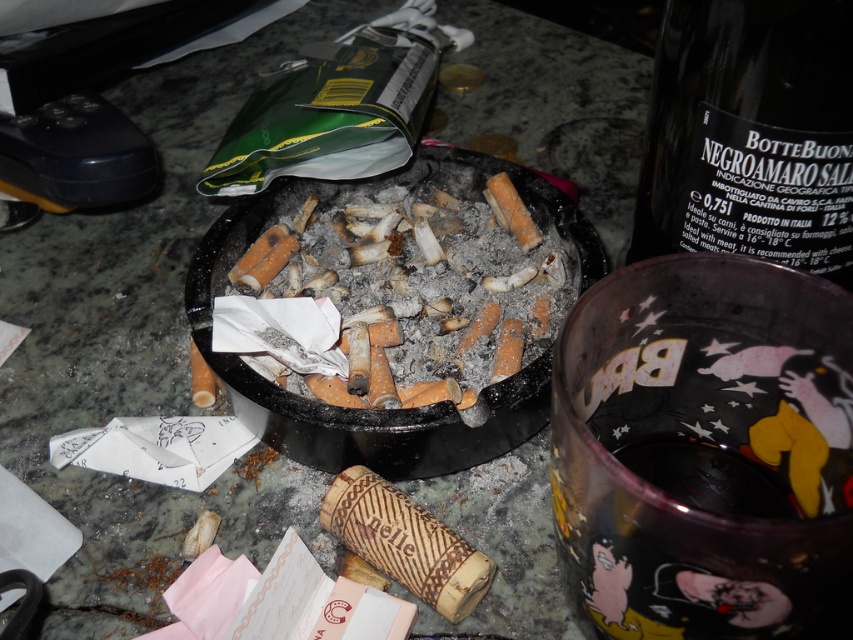
You are organizing the items on the table and need to place the dark green glass bottle at upper right and the charcoal ash at center into their respective storage containers. Which item should you pick up first to maintain the spatial arrangement?

You should pick up the charcoal ash at center first because the dark green glass bottle at upper right is to the right of it, so moving the bottle first would disrupt the original position of the charcoal ash at center.

You are organizing items on the table and need to place the dark green glass bottle at upper right and the charcoal ash at center into containers based on their height. Which container should each go into if the first container is for taller items and the second is for shorter ones?

The charcoal ash at center is taller than the dark green glass bottle at upper right, so the charcoal ash at center should go into the first container for taller items, and the dark green glass bottle at upper right should go into the second container for shorter items.